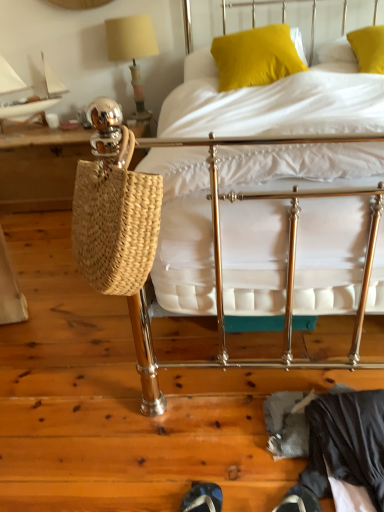
Question: Would you say yellow fabric pillow at upper center, positioned as the 1th pillow in left-to-right order, is to the left or to the right of woven straw bag at left in the picture?

Choices:
 (A) left
 (B) right

Answer: (B)

Question: Does point (241, 62) appear closer or farther from the camera than point (79, 157)?

Choices:
 (A) farther
 (B) closer

Answer: (B)

Question: Based on their relative distances, which object is farther from the shiny black shoe at lower center?

Choices:
 (A) dark gray fabric at lower right
 (B) woven straw bag at left
 (C) yellow fabric pillow at upper center, the 2th pillow in the right-to-left sequence
 (D) metallic gold bed at center
 (E) matte yellow fabric lampshade at upper left

Answer: (E)

Question: Which is nearer to the yellow fabric pillow at upper right, positioned as the 2th pillow in left-to-right order?

Choices:
 (A) woven straw bag at left
 (B) yellow fabric pillow at upper center, positioned as the 1th pillow in left-to-right order
 (C) dark gray fabric at lower right
 (D) metallic gold bed at center
 (E) shiny black shoe at lower center

Answer: (B)